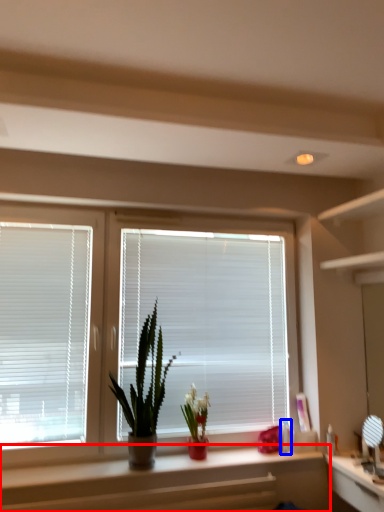
Question: Which object is closer to the camera taking this photo, counter (highlighted by a red box) or toiletry (highlighted by a blue box)?

Choices:
 (A) counter
 (B) toiletry

Answer: (A)